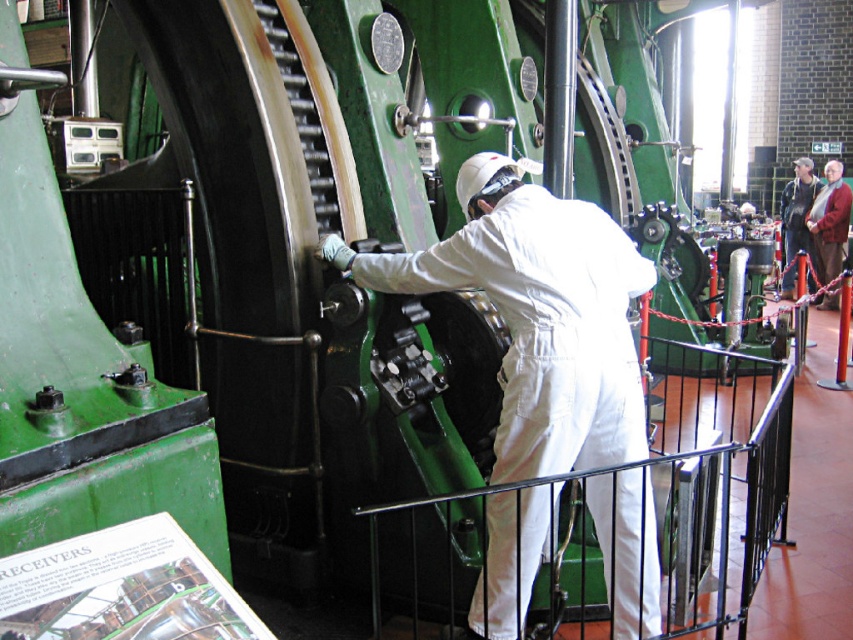
Question: Which point appears farthest from the camera in this image?

Choices:
 (A) (828, 196)
 (B) (795, 268)
 (C) (575, 317)

Answer: (B)

Question: Which point is closer to the camera?

Choices:
 (A) white matte coveralls at center
 (B) red woolen robe at right
 (C) dark brown leather robe at upper right

Answer: (A)

Question: In this image, where is white matte coveralls at center located relative to red woolen robe at right?

Choices:
 (A) right
 (B) left

Answer: (B)

Question: Can you confirm if white matte coveralls at center is positioned below dark brown leather robe at upper right?

Choices:
 (A) yes
 (B) no

Answer: (A)

Question: Which object appears closest to the camera in this image?

Choices:
 (A) dark brown leather robe at upper right
 (B) red woolen robe at right
 (C) white matte coveralls at center

Answer: (C)

Question: Is the position of white matte coveralls at center less distant than that of dark brown leather robe at upper right?

Choices:
 (A) no
 (B) yes

Answer: (B)